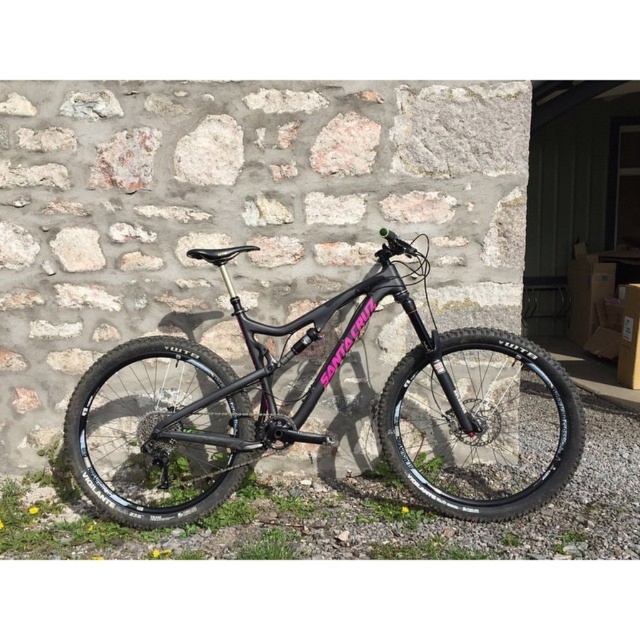
You are standing at the point where the coordinates are (296,408). Looking at the scene, what object is exactly at your current position?

The matte black mountain bike at center is located at point (296,408).

You are a delivery person carrying a 2.5 meter long box. You need to move it through the space between the matte black mountain bike at center and the stone wall. Can you fit the box through that space?

The matte black mountain bike at center and viewer are 2.17 meters apart from each other. Since the box is 2.5 meters long, it is longer than the available space between the bike and the wall. Therefore, the box cannot fit through that space.

You are a delivery person who needs to load the matte black mountain bike at center and the black rubber tire at center into a truck. The truck has a height limit of 1.5 meters. Can both items fit vertically without bending or damaging them?

The matte black mountain bike at center is taller than the black rubber tire at center. Since the truck has a height limit of 1.5 meters, we need to know the exact height of the bike. However, the description does not provide specific measurements. Therefore, it is uncertain if both items can fit vertically without bending or damaging them.